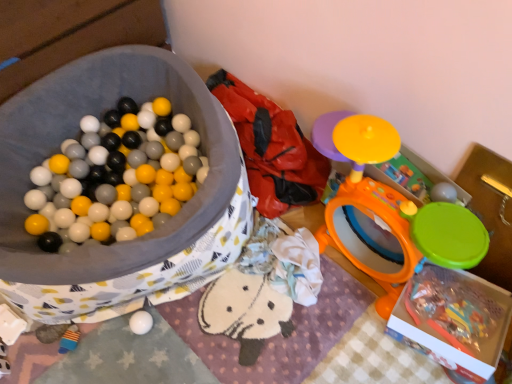
Where is `vacant area that is in front of white matte ball at lower center, marked as the third toy in a right-to-left arrangement`? This screenshot has height=384, width=512. vacant area that is in front of white matte ball at lower center, marked as the third toy in a right-to-left arrangement is located at coordinates coord(137,362).